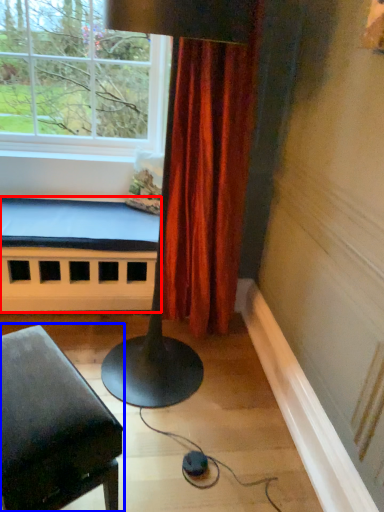
Question: Which object is further to the camera taking this photo, bed frame (highlighted by a red box) or furniture (highlighted by a blue box)?

Choices:
 (A) bed frame
 (B) furniture

Answer: (A)